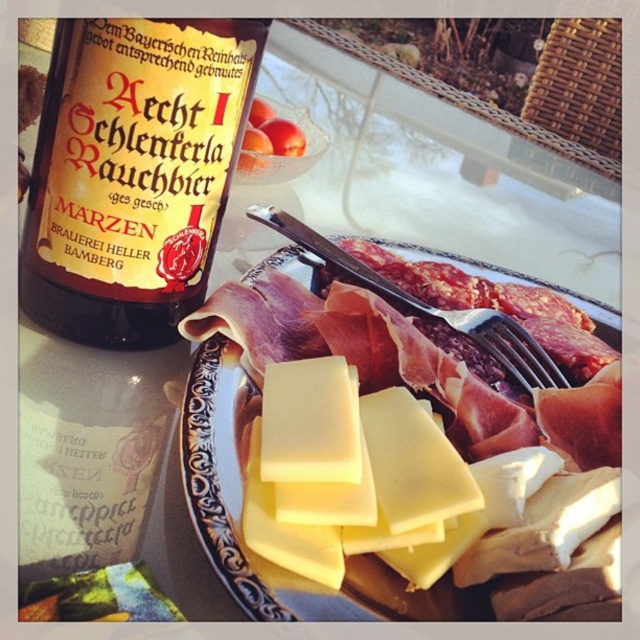
Question: Does silver metallic fork at center appear on the right side of dark red meat at center?

Choices:
 (A) yes
 (B) no

Answer: (B)

Question: Which point is closer to the camera?

Choices:
 (A) yellow hard cheese at center
 (B) yellow semi-hard cheese at center
 (C) silver metallic fork at center
 (D) dark red meat at center

Answer: (B)

Question: Is the position of yellow hard cheese at center less distant than that of yellow semi-hard cheese at center?

Choices:
 (A) no
 (B) yes

Answer: (A)

Question: Among these points, which one is nearest to the camera?

Choices:
 (A) (413, 317)
 (B) (234, 397)
 (C) (209, 237)
 (D) (452, 328)

Answer: (B)

Question: Which of the following is the farthest from the observer?

Choices:
 (A) dark red meat at center
 (B) silver metallic fork at center
 (C) yellow hard cheese at center
 (D) brown glass bottle at upper left

Answer: (B)

Question: Does brown glass bottle at upper left have a smaller size compared to yellow cheese at center?

Choices:
 (A) no
 (B) yes

Answer: (B)